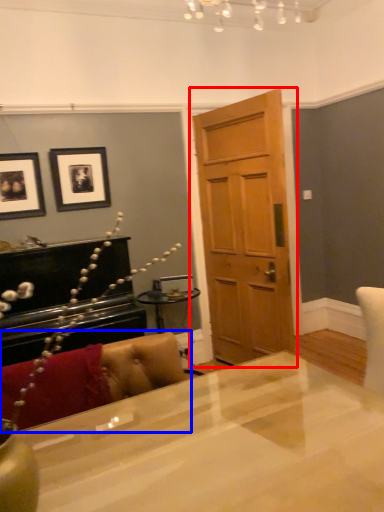
Question: Which point is closer to the camera, door (highlighted by a red box) or couch (highlighted by a blue box)?

Choices:
 (A) door
 (B) couch

Answer: (B)